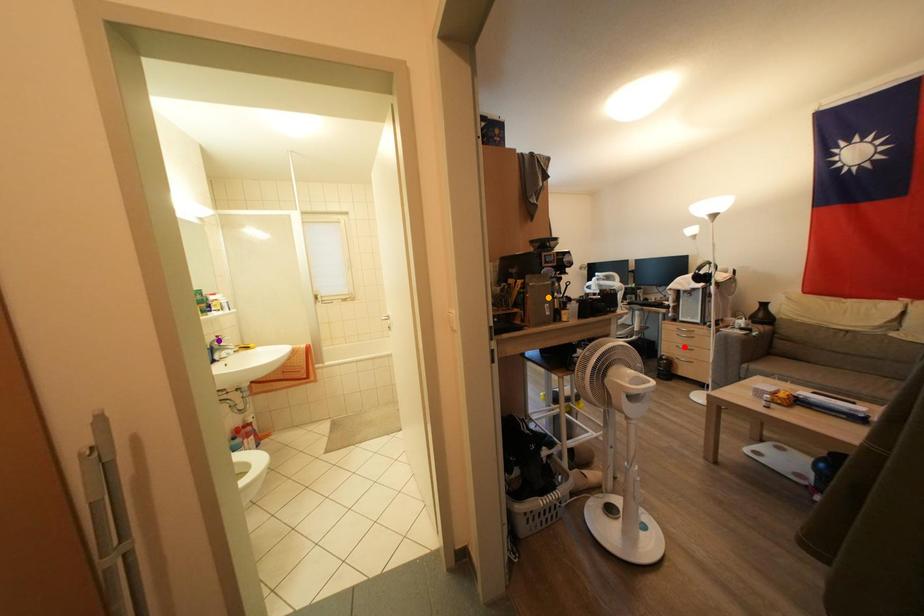
Order these from nearest to farthest:
- purple point
- orange point
- red point

red point
purple point
orange point